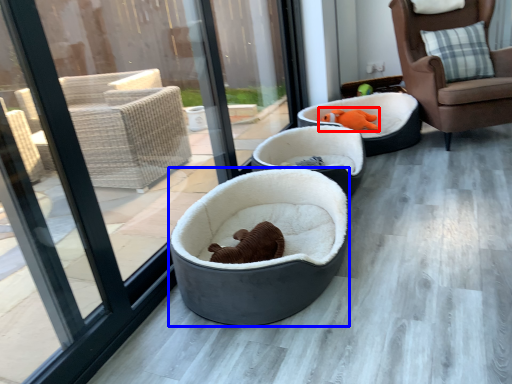
Question: Which point is closer to the camera, animal (highlighted by a red box) or dog bed (highlighted by a blue box)?

Choices:
 (A) animal
 (B) dog bed

Answer: (B)